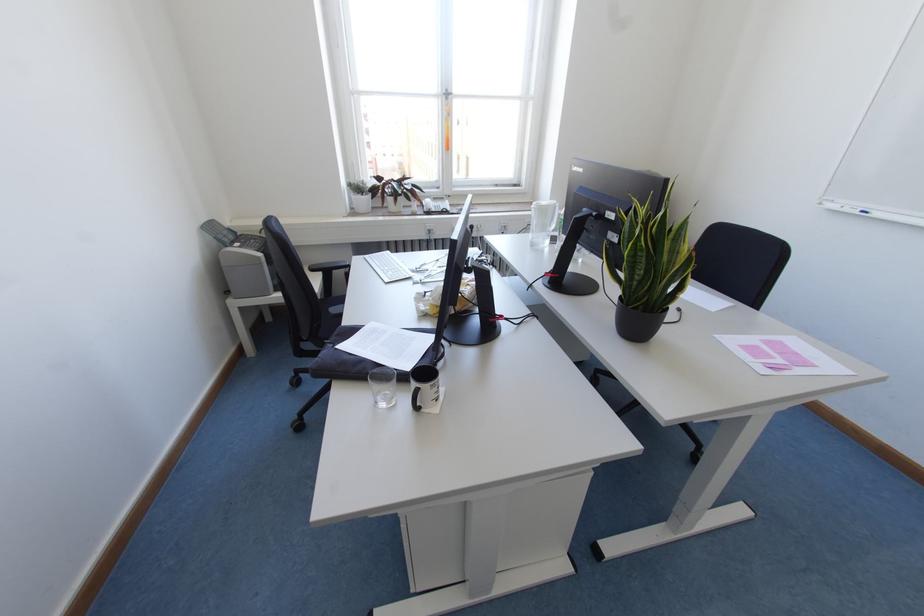
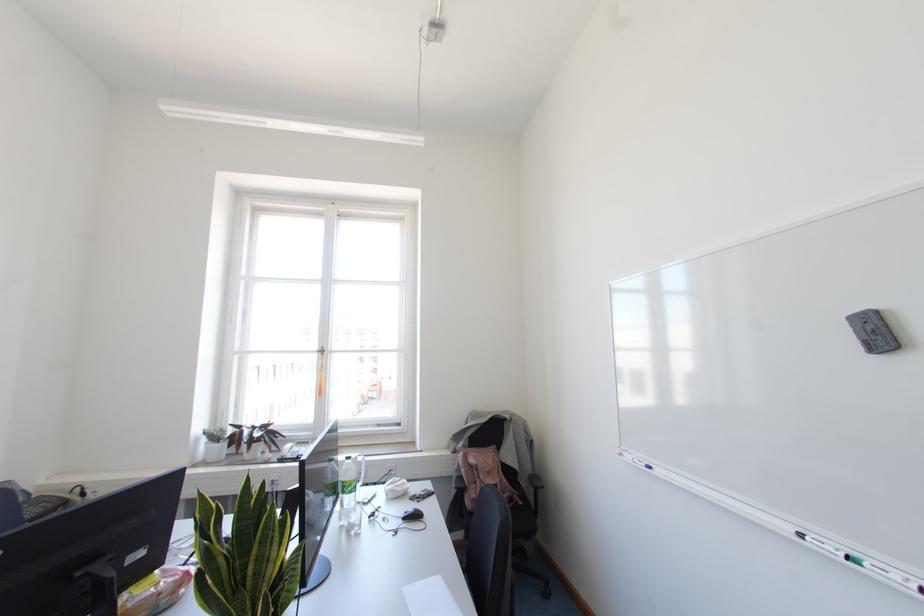
Locate, in the second image, the point that corresponds to [864,213] in the first image.

(649, 467)